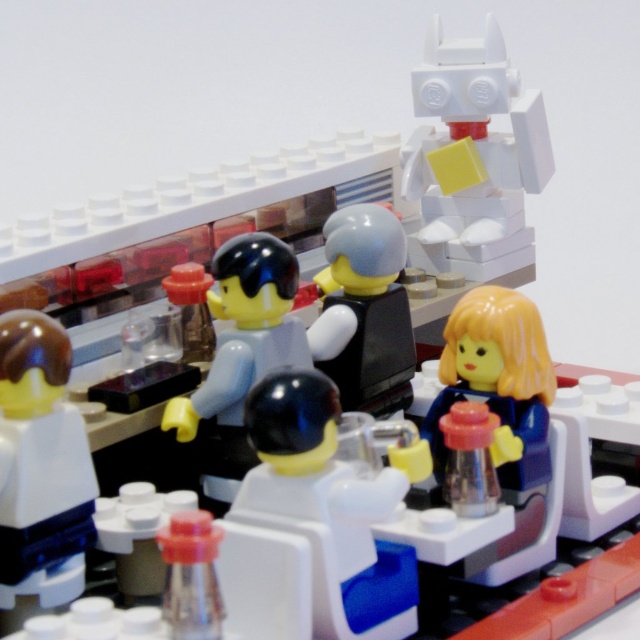
You are a visitor in this LEGO laboratory scene. You see a white plastic figure at center and a translucent blue plastic figure at center. Which one is located to the right?

The white plastic figure at center is positioned on the right side of the translucent blue plastic figure at center, so the white plastic figure at center is located to the right.

In the LEGO laboratory scene, you see a translucent blue plastic figure at center and a smooth black vest at center. Which object is positioned to the right?

The smooth black vest at center is positioned to the right of the translucent blue plastic figure at center.